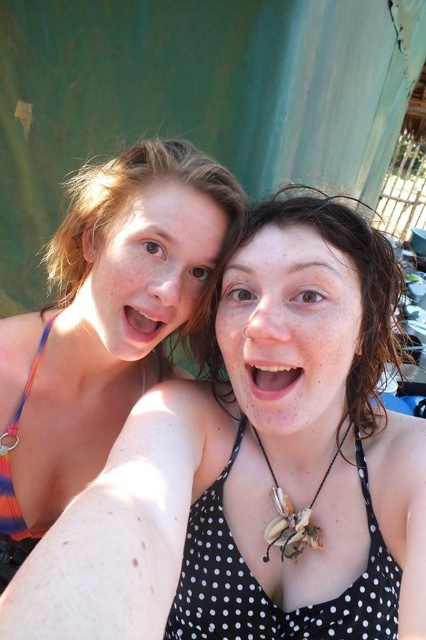
Between black polka dot bikini top at center and polka dot fabric bikini top at center, which one has less height?

black polka dot bikini top at center

Is black polka dot bikini top at center smaller than polka dot fabric bikini top at center?

Yes, black polka dot bikini top at center is smaller than polka dot fabric bikini top at center.

Locate an element on the screen. black polka dot bikini top at center is located at coordinates (262, 589).

I want to click on black polka dot bikini top at center, so click(x=262, y=589).

Is black polka dot bikini top at center to the right of multicolored fabric bikini top at left from the viewer's perspective?

Yes, black polka dot bikini top at center is to the right of multicolored fabric bikini top at left.

Is black polka dot bikini top at center positioned behind multicolored fabric bikini top at left?

No, black polka dot bikini top at center is in front of multicolored fabric bikini top at left.

Between point (207, 492) and point (25, 387), which one is positioned behind?

Point (25, 387)

What are the coordinates of `black polka dot bikini top at center` in the screenshot? It's located at (262, 589).

Is point (97, 500) closer to viewer compared to point (215, 380)?

Yes, it is.

Who is higher up, matte black bikini top at upper left or polka dot fabric bikini top at center?

polka dot fabric bikini top at center is higher up.

Which is behind, point (226, 282) or point (227, 401)?

Positioned behind is point (227, 401).

Where is `matte black bikini top at upper left`? This screenshot has width=426, height=640. matte black bikini top at upper left is located at coordinates (256, 467).